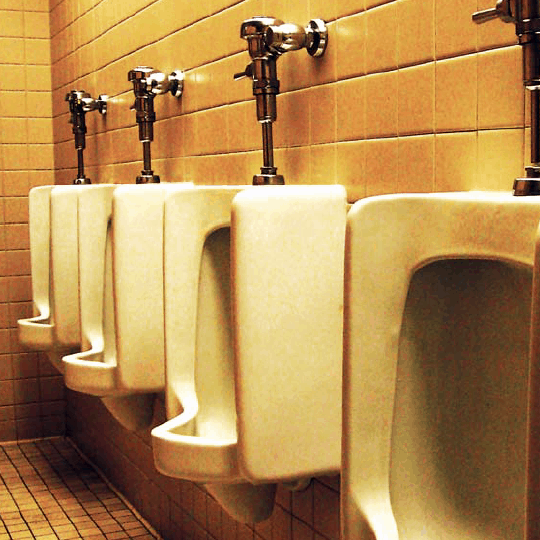
The height and width of the screenshot is (540, 540). In order to click on flush handle in this screenshot , I will do `click(472, 12)`, `click(241, 72)`, `click(130, 109)`, `click(66, 113)`.